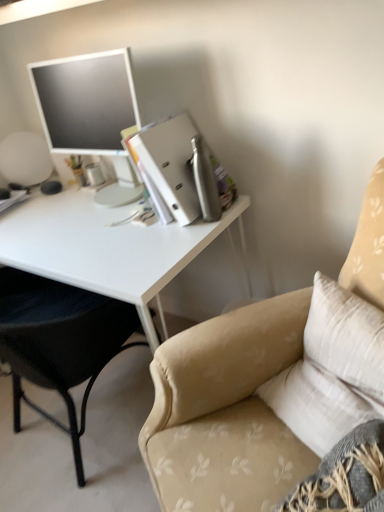
This screenshot has width=384, height=512. In order to click on vacant space underneath matte silver monitor at upper left (from a real-world perspective) in this screenshot , I will do `click(114, 194)`.